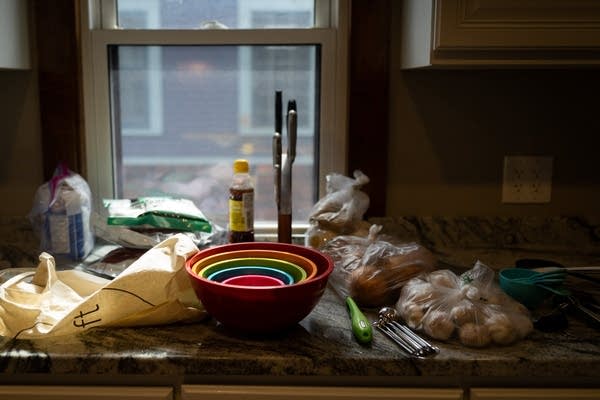
Find the location of `bowls`. bowls is located at coordinates (248, 281), (238, 272), (247, 261), (252, 254), (268, 241).